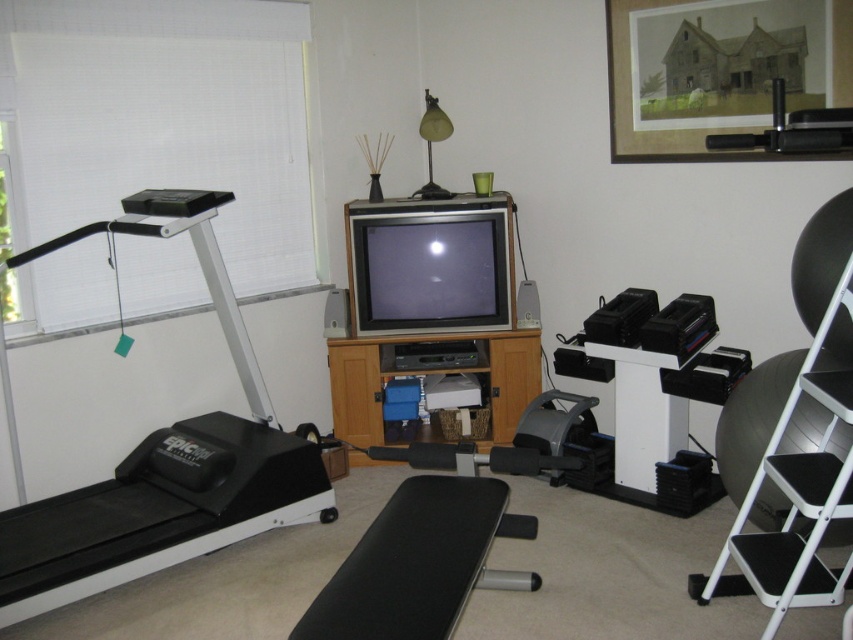
Question: Which point is farther to the camera?

Choices:
 (A) (770, 141)
 (B) (456, 548)
 (C) (767, 465)

Answer: (C)

Question: Based on their relative distances, which object is nearer to the wooden entertainment center at center?

Choices:
 (A) wooden framed picture at upper center
 (B) black matte bench at center
 (C) black rubber treadmill at left

Answer: (C)

Question: Does white matte step ladder at right appear on the left side of black rubber barbell at upper right?

Choices:
 (A) no
 (B) yes

Answer: (A)

Question: Is black rubber treadmill at left to the right of black matte bench at center from the viewer's perspective?

Choices:
 (A) no
 (B) yes

Answer: (A)

Question: Does wooden framed picture at upper center have a smaller size compared to white matte step ladder at right?

Choices:
 (A) yes
 (B) no

Answer: (B)

Question: Which object appears farthest from the camera in this image?

Choices:
 (A) black matte bench at center
 (B) white matte step ladder at right

Answer: (B)